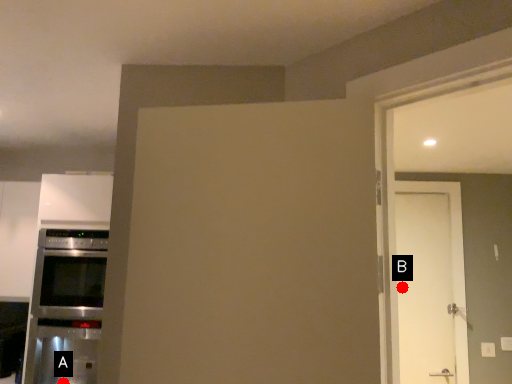
Question: Two points are circled on the image, labeled by A and B beside each circle. Which point is farther to the camera?

Choices:
 (A) A is further
 (B) B is further

Answer: (B)